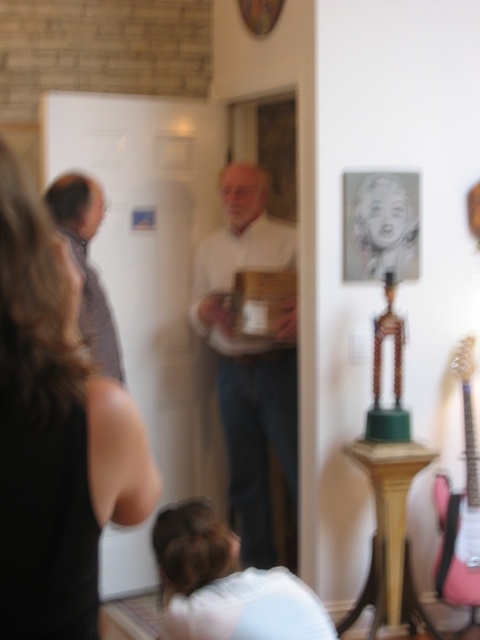
You are standing at point (211,524) and want to walk to point (73,280). Is there a clear path between these two points without any obstacles?

Yes, since point (73,280) is in front of point (211,524), there is a clear path between them without obstacles.

You are attending an art exhibition and notice two people in the scene described. The smooth black dress at lower left is worn by a woman, and the white matte shirt at center is worn by a man. Which clothing item is shorter in length?

The smooth black dress at lower left is shorter than the white matte shirt at center.

Based on the scene description, where is the smooth black dress at lower left located in terms of coordinates?

The smooth black dress at lower left is located at coordinates point (55, 433).